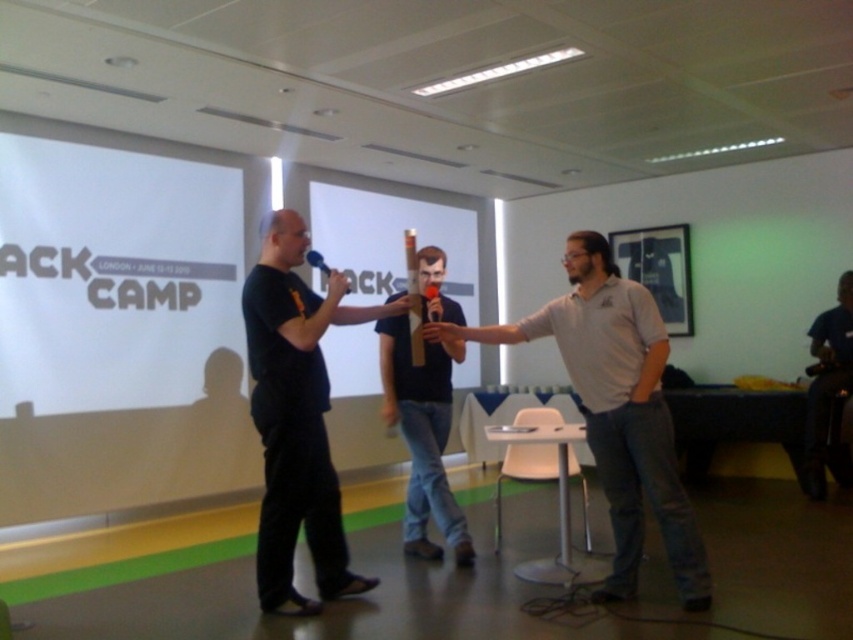
You are standing in the conference room and need to locate the person wearing the black matte shirt at center. According to the scene description, where should you look to find them?

The black matte shirt at center is located at point [296,417] in the image coordinates.